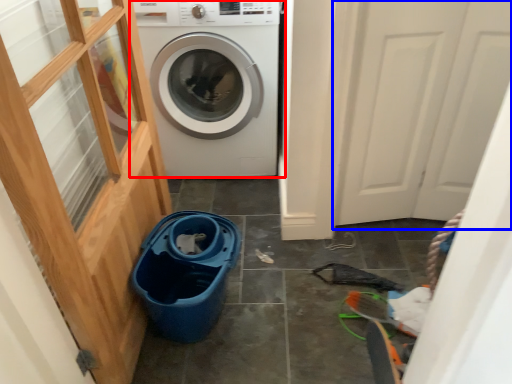
Question: Which point is closer to the camera, washing machine (highlighted by a red box) or screen door (highlighted by a blue box)?

Choices:
 (A) washing machine
 (B) screen door

Answer: (B)